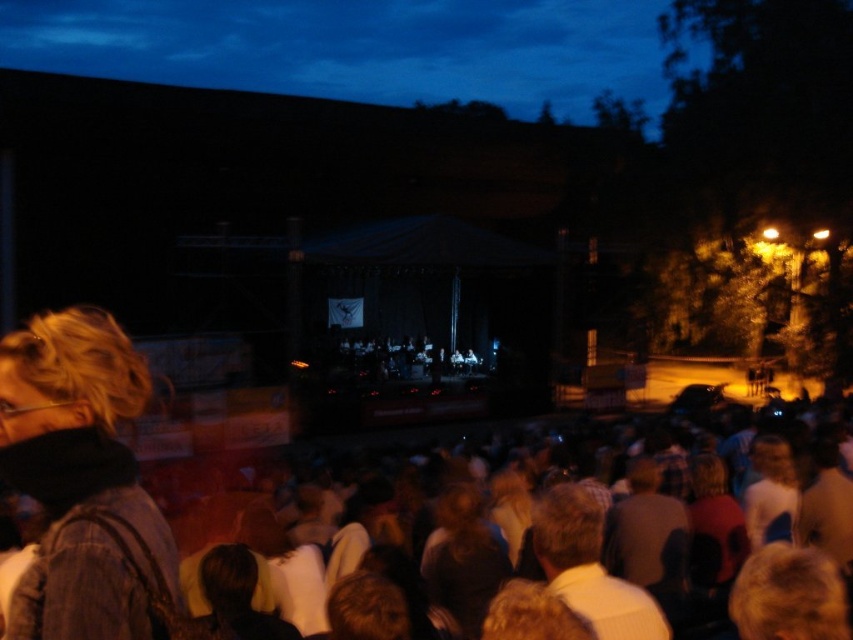
In the scene shown: Is gray fabric shirt at center thinner than light brown hair at center?

Yes, gray fabric shirt at center is thinner than light brown hair at center.

Is point (637, 468) positioned in front of point (782, 470)?

That is True.

Identify the location of gray fabric shirt at center. (647, 532).

Where is `white cotton shirt at center`? The width and height of the screenshot is (853, 640). white cotton shirt at center is located at coordinates (589, 566).

Which is behind, point (587, 596) or point (648, 474)?

Point (648, 474)

Locate an element on the screen. white cotton shirt at center is located at coordinates (589, 566).

Is white cotton shirt at center closer to the viewer compared to blonde hair at lower right?

No, it is behind blonde hair at lower right.

Which is more to the left, white cotton shirt at center or blonde hair at lower right?

Positioned to the left is white cotton shirt at center.

Where is `white cotton shirt at center`? white cotton shirt at center is located at coordinates (589, 566).